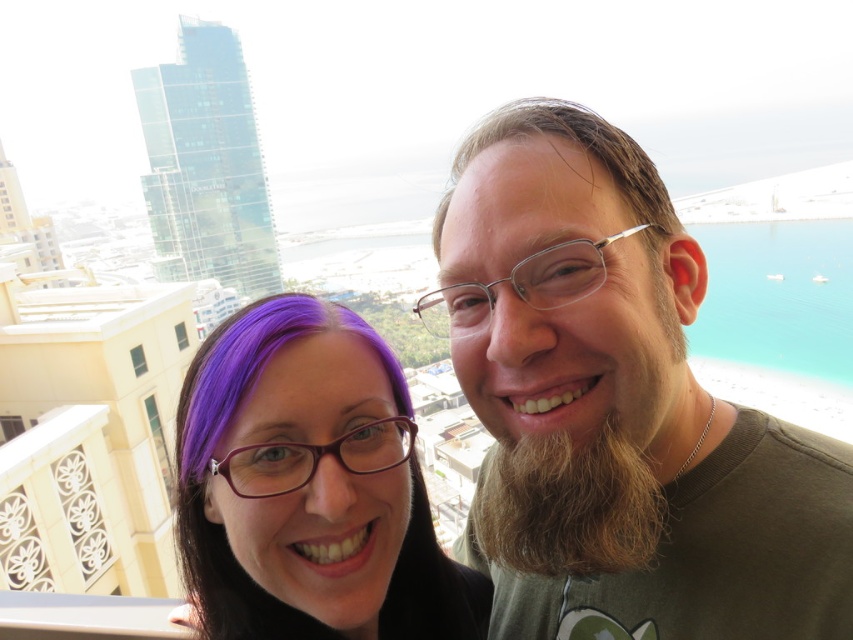
Question: Which object is farther from the camera taking this photo?

Choices:
 (A) brown fuzzy beard at right
 (B) brown matte shirt at right

Answer: (A)

Question: Is brown matte shirt at right closer to camera compared to brown matte hair at upper center?

Choices:
 (A) no
 (B) yes

Answer: (B)

Question: Which object is positioned closest to the purple hair at center?

Choices:
 (A) brown fuzzy beard at right
 (B) brown matte hair at upper center
 (C) brown matte shirt at right

Answer: (A)

Question: Which point appears farthest from the camera in this image?

Choices:
 (A) [x=527, y=100]
 (B) [x=521, y=284]

Answer: (A)

Question: Can you confirm if purple hair at center is smaller than brown matte hair at upper center?

Choices:
 (A) no
 (B) yes

Answer: (B)

Question: From the image, what is the correct spatial relationship of brown fuzzy beard at right in relation to brown matte hair at upper center?

Choices:
 (A) right
 (B) left

Answer: (B)